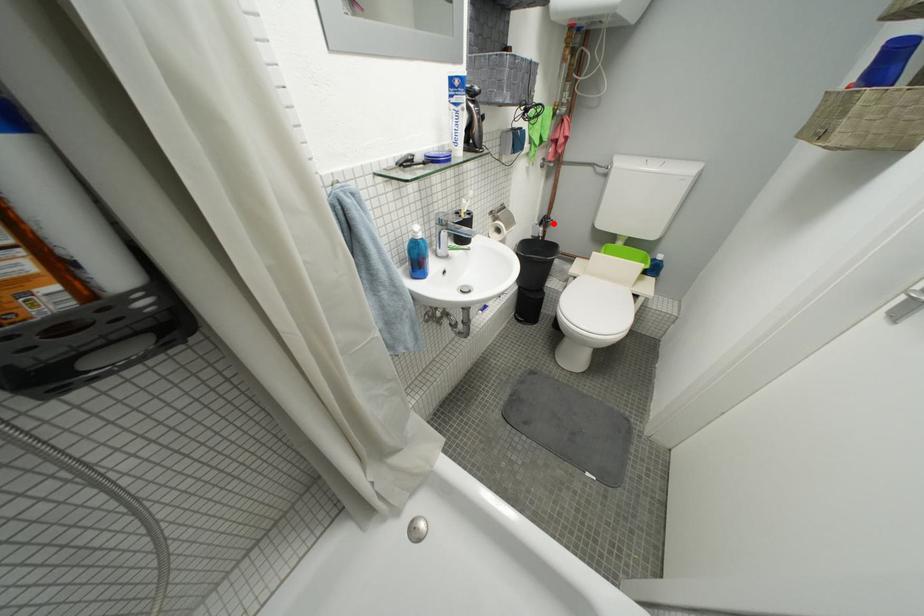
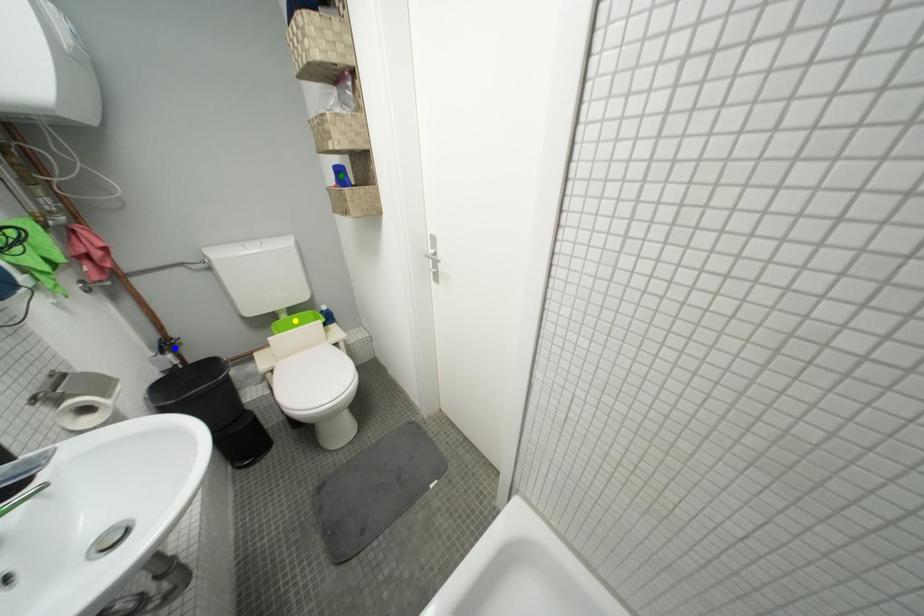
Question: I am providing you with two images of the same scene from different viewpoints. A red point is marked on the first image. You are given multiple points on the second image. Which spot in image 2 lines up with the point in image 1?

Choices:
 (A) yellow point
 (B) green point
 (C) blue point

Answer: (C)